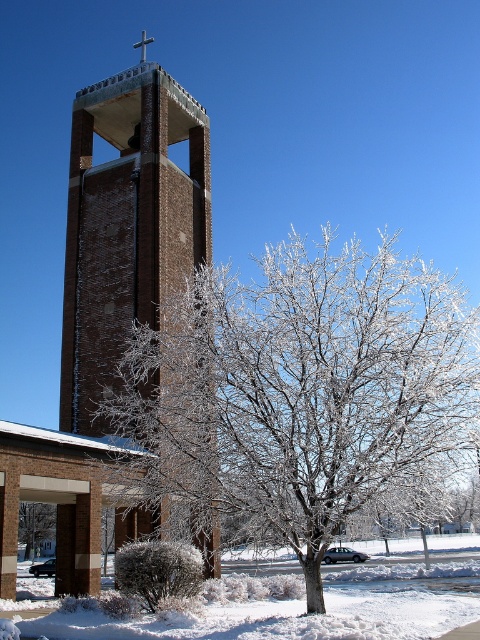
Question: Which object is farther from the camera taking this photo?

Choices:
 (A) brick tower at center
 (B) frosted white tree at center

Answer: (A)

Question: Which point is farther from the camera taking this photo?

Choices:
 (A) (36, 538)
 (B) (171, 616)
 (C) (83, 314)

Answer: (A)

Question: Which point appears farthest from the camera in this image?

Choices:
 (A) (172, 106)
 (B) (26, 545)

Answer: (B)

Question: From the image, what is the correct spatial relationship of white frosty snow at lower center in relation to white frosty tree at center?

Choices:
 (A) left
 (B) right

Answer: (B)

Question: Does frosted white tree at center have a greater width compared to white frosty snow at lower center?

Choices:
 (A) yes
 (B) no

Answer: (B)

Question: Can you confirm if white frosty snow at lower center is wider than frosted bush at lower center?

Choices:
 (A) no
 (B) yes

Answer: (B)